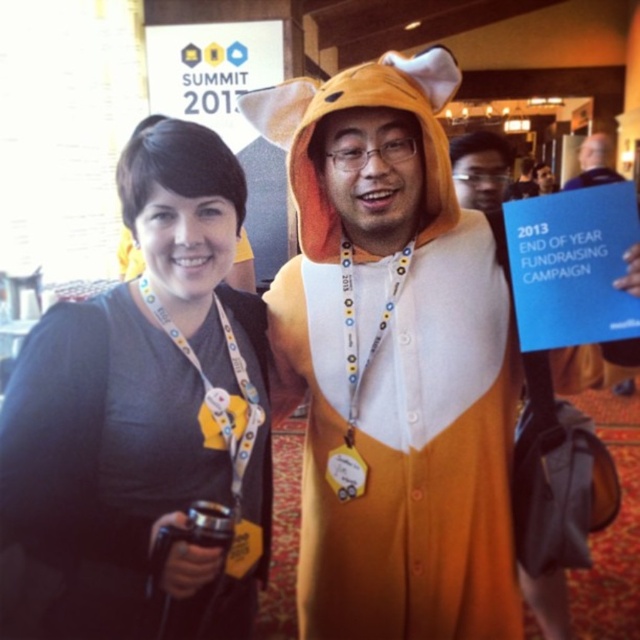
Consider the image. You are attending the SUMMIT 2013 event and notice two people in front of you. One is wearing an orange plush onesie at center and the other has a blue fabric shirt at upper right. Which clothing item is taller?

The orange plush onesie at center is taller than the blue fabric shirt at upper right.

You are attending the SUMMIT 2013 event and notice two people in front of you. One is wearing an orange plush onesie at center and the other has a blue fabric shirt at upper right. Which clothing item is positioned lower in the image?

The orange plush onesie at center is located below the blue fabric shirt at upper right, so the orange plush onesie at center is positioned lower in the image.